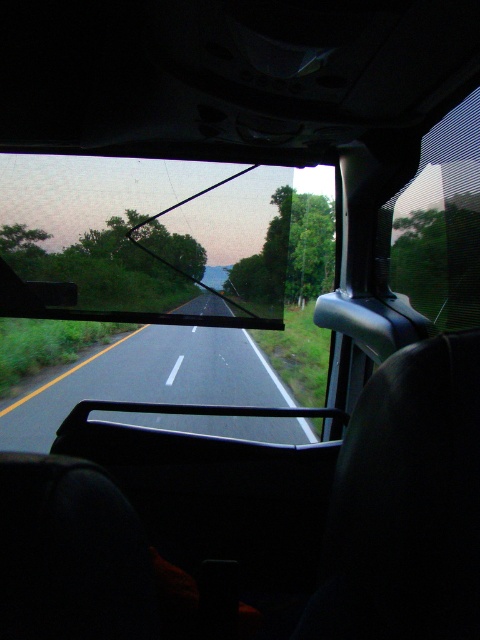
Measure the distance from transparent glass windshield at center to transparent mesh car window at right.

18.93 feet

Does transparent glass windshield at center have a larger size compared to transparent mesh car window at right?

Yes.

Does point (0, 228) come in front of point (424, 310)?

No.

Where is `transparent glass windshield at center`? The height and width of the screenshot is (640, 480). transparent glass windshield at center is located at coordinates (168, 280).